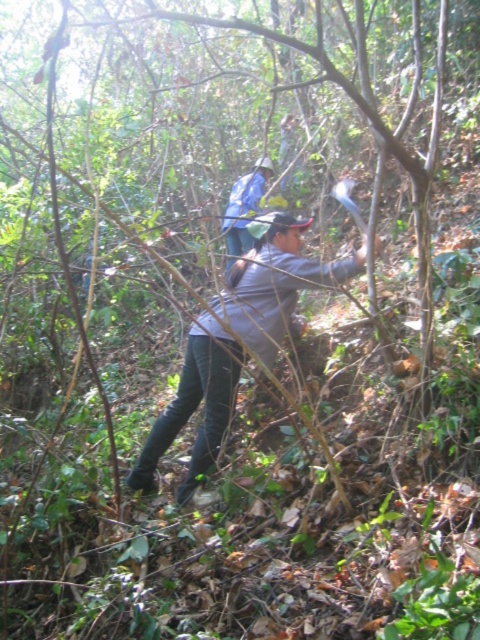
Which is more to the right, gray fabric shirt at center or blue fabric shirt at center?

From the viewer's perspective, blue fabric shirt at center appears more on the right side.

Is the position of gray fabric shirt at center less distant than that of blue fabric shirt at center?

Yes, it is in front of blue fabric shirt at center.

Is point (295, 288) positioned in front of point (228, 205)?

Yes, it is in front of point (228, 205).

Locate an element on the screen. gray fabric shirt at center is located at coordinates (236, 340).